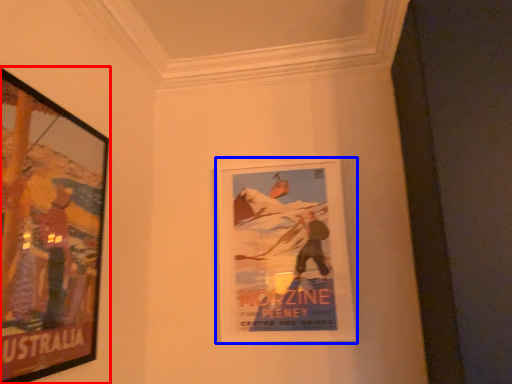
Question: Which object appears farthest to the camera in this image, picture frame (highlighted by a red box) or picture frame (highlighted by a blue box)?

Choices:
 (A) picture frame
 (B) picture frame

Answer: (B)